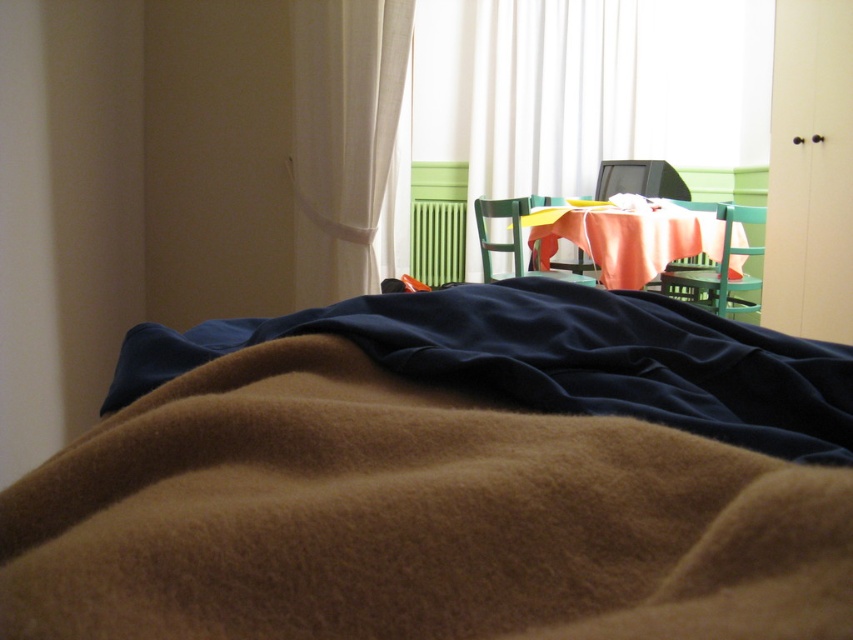
Who is positioned more to the left, green plastic chair at upper center or wooden chair at center?

wooden chair at center

What do you see at coordinates (717, 266) in the screenshot? The height and width of the screenshot is (640, 853). I see `green plastic chair at upper center` at bounding box center [717, 266].

The image size is (853, 640). Identify the location of green plastic chair at upper center. (717, 266).

Can you confirm if white fabric curtain at upper left is thinner than green plastic chair at center?

Yes, white fabric curtain at upper left is thinner than green plastic chair at center.

Does white fabric curtain at upper left come behind green plastic chair at center?

No, white fabric curtain at upper left is in front of green plastic chair at center.

Which is in front, point (389, 97) or point (514, 236)?

Point (389, 97) is more forward.

The width and height of the screenshot is (853, 640). Find the location of `white fabric curtain at upper left`. white fabric curtain at upper left is located at coordinates (345, 140).

Is white fabric curtain at upper left below green plastic chair at upper center?

Actually, white fabric curtain at upper left is above green plastic chair at upper center.

Can you confirm if white fabric curtain at upper left is thinner than green plastic chair at upper center?

Indeed, white fabric curtain at upper left has a lesser width compared to green plastic chair at upper center.

This screenshot has height=640, width=853. What do you see at coordinates (345, 140) in the screenshot? I see `white fabric curtain at upper left` at bounding box center [345, 140].

The height and width of the screenshot is (640, 853). Find the location of `white fabric curtain at upper left`. white fabric curtain at upper left is located at coordinates (345, 140).